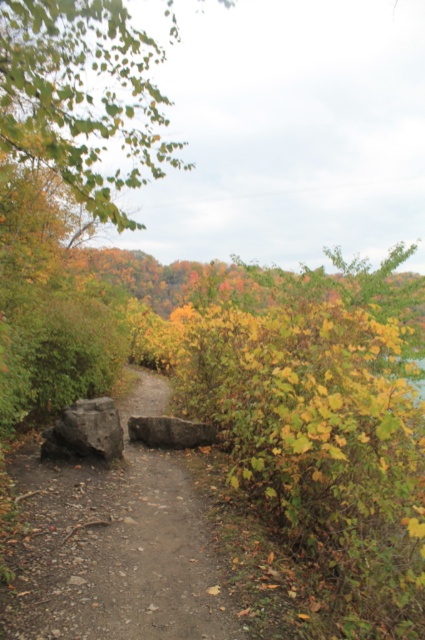
Question: Does green leafy tree at upper left appear on the right side of dark gray rock at center?

Choices:
 (A) no
 (B) yes

Answer: (A)

Question: Based on their relative distances, which object is nearer to the gray rough stone at center?

Choices:
 (A) green leafy tree at upper left
 (B) dark gray rock at center

Answer: (B)

Question: Estimate the real-world distances between objects in this image. Which object is farther from the dark gray rock at center?

Choices:
 (A) green leafy tree at upper left
 (B) gray rough stone at center

Answer: (A)

Question: Which point is farther to the camera?

Choices:
 (A) (155, 131)
 (B) (204, 429)
 (C) (116, 458)

Answer: (A)

Question: Is green leafy tree at upper left closer to the viewer compared to gray rough stone at center?

Choices:
 (A) yes
 (B) no

Answer: (A)

Question: Is dark gray rock at center smaller than gray rough stone at center?

Choices:
 (A) no
 (B) yes

Answer: (A)